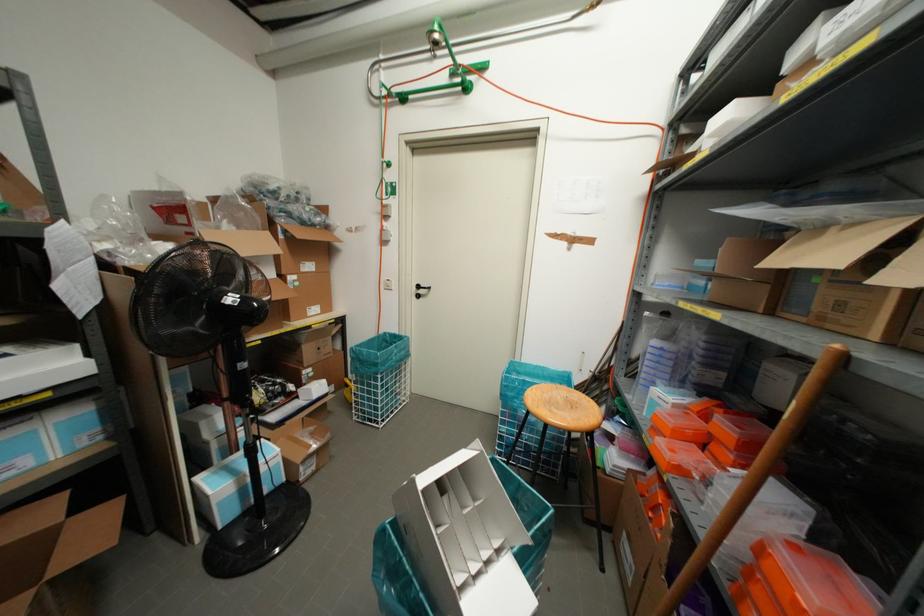
Image resolution: width=924 pixels, height=616 pixels. What do you see at coordinates (563, 407) in the screenshot?
I see `the stool sitting surface` at bounding box center [563, 407].